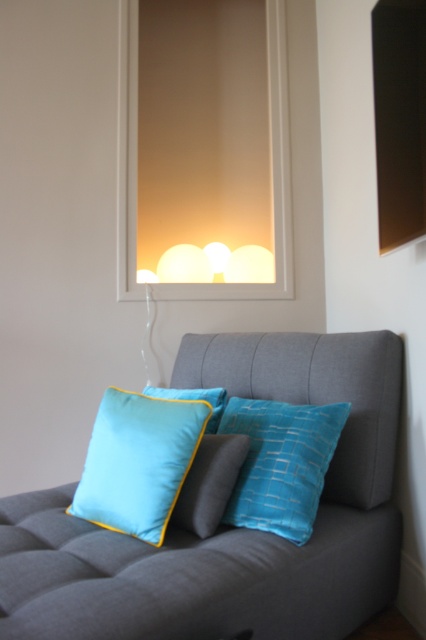
Question: Among these points, which one is nearest to the camera?

Choices:
 (A) (190, 445)
 (B) (302, 541)
 (C) (357, 406)
 (D) (216, 410)

Answer: (B)

Question: Considering the real-world distances, which object is closest to the turquoise satin pillow at center?

Choices:
 (A) tufted fabric couch at center
 (B) teal fabric cushion at center
 (C) twill blue pillow at center

Answer: (A)

Question: Is the position of tufted fabric couch at center less distant than that of twill blue pillow at center?

Choices:
 (A) no
 (B) yes

Answer: (B)

Question: Can you confirm if teal fabric cushion at center is positioned above twill blue pillow at center?

Choices:
 (A) no
 (B) yes

Answer: (A)

Question: Can you confirm if tufted fabric couch at center is smaller than teal fabric cushion at center?

Choices:
 (A) no
 (B) yes

Answer: (A)

Question: Which object is positioned closest to the twill blue pillow at center?

Choices:
 (A) teal fabric cushion at center
 (B) tufted fabric couch at center

Answer: (A)